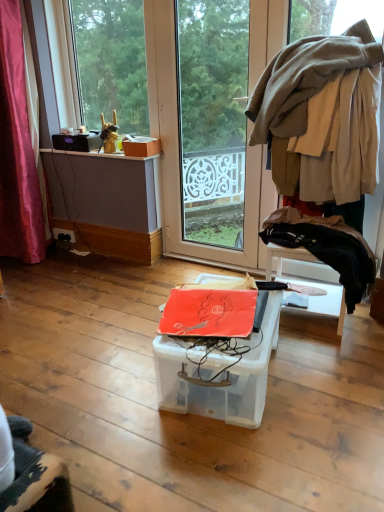
Question: Considering the relative sizes of beige woolen sweater at upper right, which is counted as the first clothing, starting from the top, and black fabric at right, which is the second clothing from top to bottom, in the image provided, is beige woolen sweater at upper right, which is counted as the first clothing, starting from the top, smaller than black fabric at right, which is the second clothing from top to bottom,?

Choices:
 (A) no
 (B) yes

Answer: (A)

Question: From a real-world perspective, is beige woolen sweater at upper right, which is counted as the first clothing, starting from the top, located higher than black fabric at right, which is the second clothing from top to bottom?

Choices:
 (A) yes
 (B) no

Answer: (A)

Question: Is beige woolen sweater at upper right, acting as the 2th clothing starting from the bottom, to the right of black fabric at right, which is the second clothing from top to bottom, from the viewer's perspective?

Choices:
 (A) no
 (B) yes

Answer: (B)

Question: From the image's perspective, is beige woolen sweater at upper right, which is counted as the first clothing, starting from the top, located above black fabric at right, which is the 1th clothing from bottom to top?

Choices:
 (A) yes
 (B) no

Answer: (A)

Question: Can you confirm if beige woolen sweater at upper right, acting as the 2th clothing starting from the bottom, is wider than black fabric at right, which is the 1th clothing from bottom to top?

Choices:
 (A) yes
 (B) no

Answer: (A)

Question: Is black plastic power outlet at lower left inside or outside of matte cardboard box at upper left?

Choices:
 (A) outside
 (B) inside

Answer: (A)

Question: Considering the positions of black plastic power outlet at lower left and matte cardboard box at upper left in the image, is black plastic power outlet at lower left bigger or smaller than matte cardboard box at upper left?

Choices:
 (A) big
 (B) small

Answer: (B)

Question: In the image, is black plastic power outlet at lower left on the left side or the right side of matte cardboard box at upper left?

Choices:
 (A) right
 (B) left

Answer: (B)

Question: From the image's perspective, is black plastic power outlet at lower left located above or below matte cardboard box at upper left?

Choices:
 (A) below
 (B) above

Answer: (A)

Question: From their relative heights in the image, would you say matte cardboard box at upper left is taller or shorter than matte orange box at upper left?

Choices:
 (A) tall
 (B) short

Answer: (A)

Question: Is matte cardboard box at upper left wider or thinner than matte orange box at upper left?

Choices:
 (A) thin
 (B) wide

Answer: (A)

Question: Visually, is matte cardboard box at upper left positioned to the left or to the right of matte orange box at upper left?

Choices:
 (A) left
 (B) right

Answer: (B)

Question: Looking at the image, does matte cardboard box at upper left seem bigger or smaller compared to matte orange box at upper left?

Choices:
 (A) small
 (B) big

Answer: (A)

Question: Is transparent plastic box at center wider or thinner than matte orange box at upper left?

Choices:
 (A) wide
 (B) thin

Answer: (A)

Question: Is transparent plastic box at center taller or shorter than matte orange box at upper left?

Choices:
 (A) short
 (B) tall

Answer: (B)